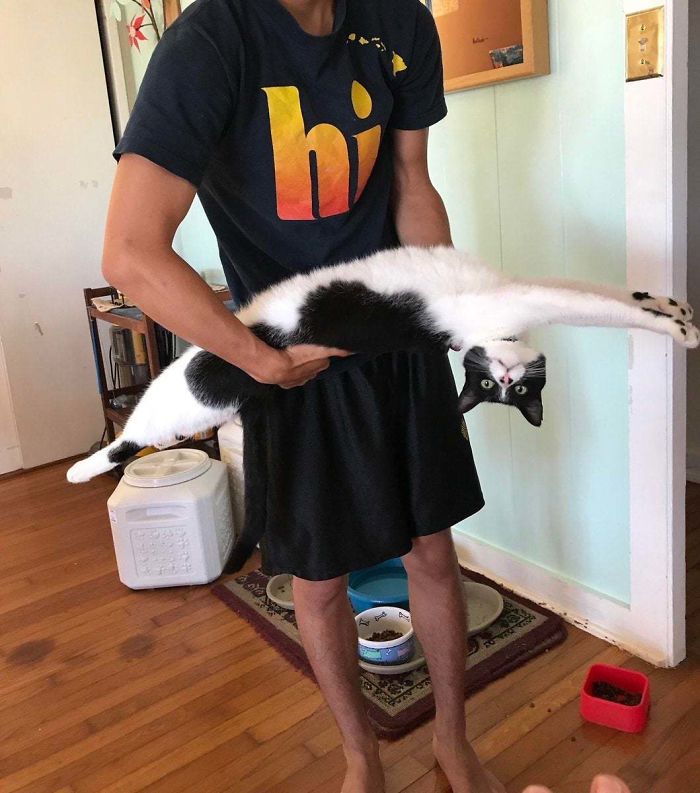
Locate an element on the screen. The image size is (700, 793). mat is located at coordinates (526, 633).